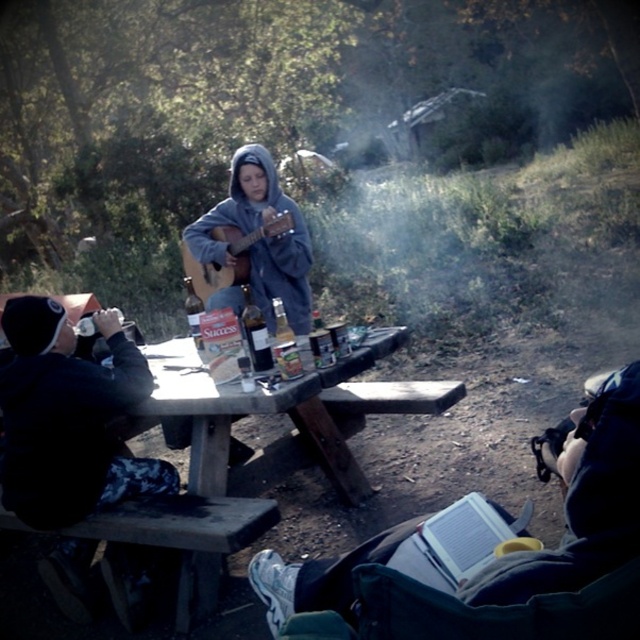
Who is more forward, (554, 561) or (250, 321)?

Point (554, 561) is more forward.

Between dark gray hoodie at center and translucent glass bottle at center, which one has less height?

Standing shorter between the two is translucent glass bottle at center.

At what (x,y) coordinates should I click in order to perform the action: click on dark gray hoodie at center. Please return your answer as a coordinate pair (x, y). Looking at the image, I should click on (582, 502).

At what (x,y) coordinates should I click in order to perform the action: click on dark gray hoodie at center. Please return your answer as a coordinate pair (x, y). Looking at the image, I should click on click(582, 502).

Where is `dark gray hoodie at center`? dark gray hoodie at center is located at coordinates (582, 502).

Is translucent glass bottle at center behind clear glass bottle at center?

No, translucent glass bottle at center is closer to the viewer.

Who is taller, translucent glass bottle at center or clear glass bottle at center?

translucent glass bottle at center is taller.

Is point (260, 330) positioned before point (196, 339)?

Yes, point (260, 330) is in front of point (196, 339).

The width and height of the screenshot is (640, 640). What are the coordinates of `translucent glass bottle at center` in the screenshot? It's located at (256, 332).